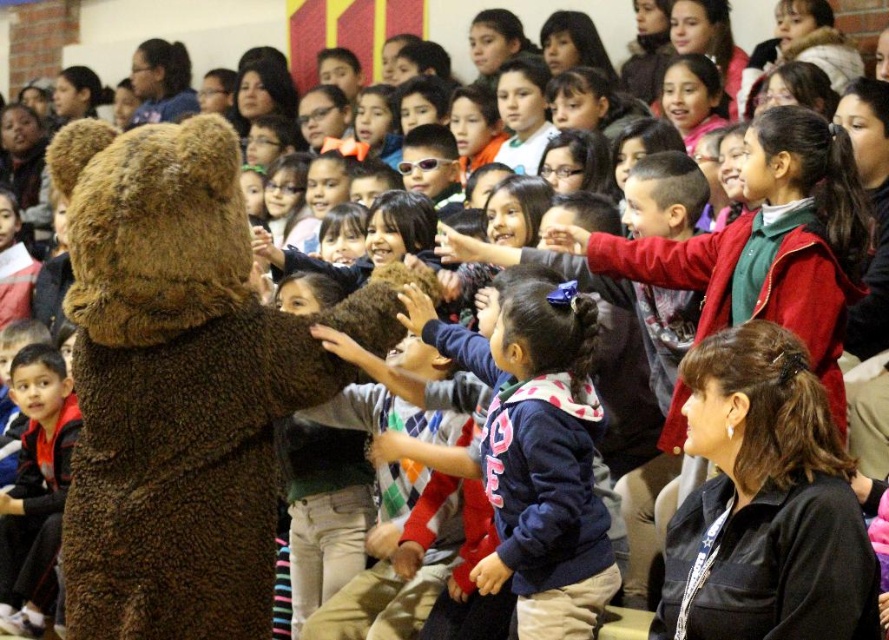
This screenshot has height=640, width=889. What do you see at coordinates (180, 385) in the screenshot?
I see `fuzzy brown bear at center` at bounding box center [180, 385].

The image size is (889, 640). In order to click on fuzzy brown bear at center in this screenshot , I will do `click(180, 385)`.

Does fuzzy brown bear at center have a lesser height compared to red fleece jacket at left?

In fact, fuzzy brown bear at center may be taller than red fleece jacket at left.

Who is higher up, fuzzy brown bear at center or red fleece jacket at left?

fuzzy brown bear at center is above.

Who is more forward, (189,253) or (2,548)?

Positioned in front is point (189,253).

This screenshot has height=640, width=889. I want to click on fuzzy brown bear at center, so click(180, 385).

Is navy fleece jacket at center shorter than red fleece jacket at left?

Indeed, navy fleece jacket at center has a lesser height compared to red fleece jacket at left.

Does navy fleece jacket at center appear on the left side of red fleece jacket at left?

Incorrect, navy fleece jacket at center is not on the left side of red fleece jacket at left.

From the picture: Who is more forward, (570,621) or (19,352)?

Point (570,621)

This screenshot has width=889, height=640. I want to click on navy fleece jacket at center, so click(x=546, y=467).